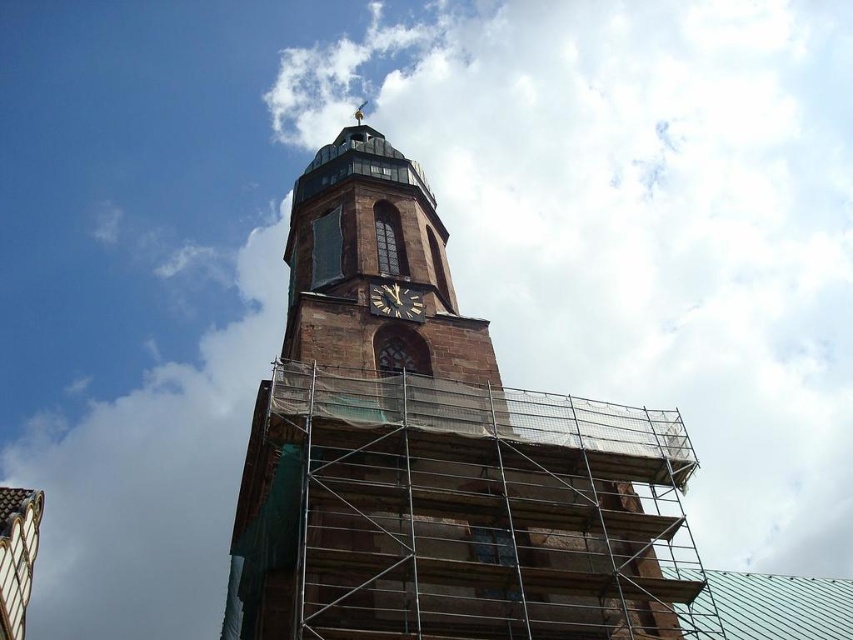
You are an architect inspecting the construction site of the brown stone clock tower at center and the black polished wood clock at center. Which structure has a bigger footprint on the ground?

The brown stone clock tower at center has a larger size compared to the black polished wood clock at center, so it has a bigger footprint on the ground.

You are an architect examining the construction plans of the clock tower. You notice two points marked on the blueprint at coordinates point (467, 488) and point (289, 323). Based on the image provided, which point is closer to the observer?

Point (467, 488) is in front of point (289, 323), so it is closer to the observer.

You are a construction worker assessing the height of the brown stone church at center and the black polished wood clock at center in the image. Which one is taller?

The brown stone church at center is much taller than the black polished wood clock at center.